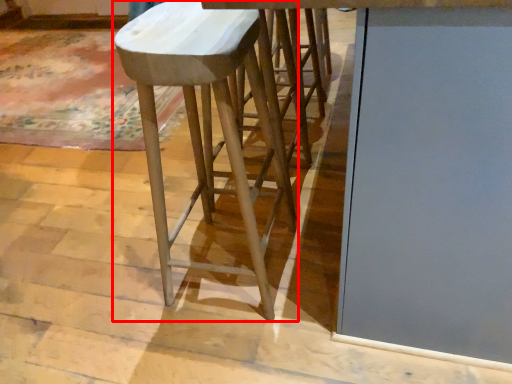
Question: In this image, where is stool (annotated by the red box) located relative to glass door?

Choices:
 (A) right
 (B) left

Answer: (B)